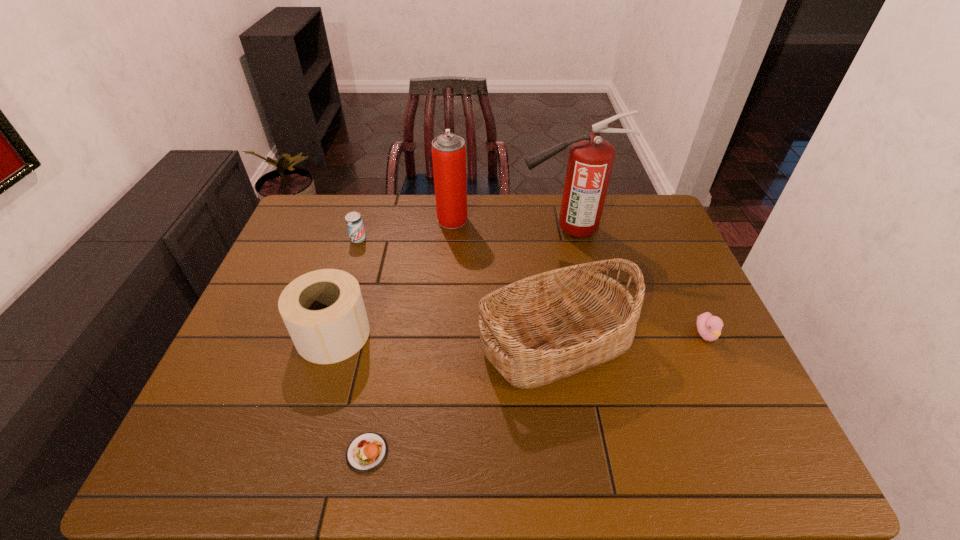
Identify the location of free region located 0.080m at the nozzle of the tallest object. The width and height of the screenshot is (960, 540). (495, 230).

Locate an element on the screen. The width and height of the screenshot is (960, 540). free space located 0.150m at the nozzle of the tallest object is located at coordinates (474, 230).

Find the location of a particular element. free location located 0.360m at the nozzle of the tallest object is located at coordinates (412, 230).

What are the coordinates of `free space located 0.070m on the right of the fourth object from left to right` in the screenshot? It's located at (488, 220).

This screenshot has width=960, height=540. What are the coordinates of `vacant space located 0.100m on the right of the fifth shortest object` in the screenshot? It's located at click(x=670, y=341).

In order to click on free spot located on the front of the fourth shortest object in this screenshot , I will do `click(318, 386)`.

You are a GUI agent. You are given a task and a screenshot of the screen. Output one action in this format:
    pyautogui.click(x=<x>, y=<y>)
    Task: Click on the vacant region located on the front of the beer can
    This screenshot has width=960, height=540.
    Given the screenshot: What is the action you would take?
    pyautogui.click(x=327, y=338)

You are a GUI agent. You are given a task and a screenshot of the screen. Output one action in this format:
    pyautogui.click(x=<x>, y=<y>)
    Task: Click on the vacant area situated on the front-facing side of the duckling
    
    Given the screenshot: What is the action you would take?
    pyautogui.click(x=725, y=375)

Find the location of a particular element. The height and width of the screenshot is (540, 960). vacant space positioned 0.260m on the left of the nearest object is located at coordinates click(224, 453).

Where is `fire extinguisher that is positioned at the far edge`? fire extinguisher that is positioned at the far edge is located at coordinates (590, 161).